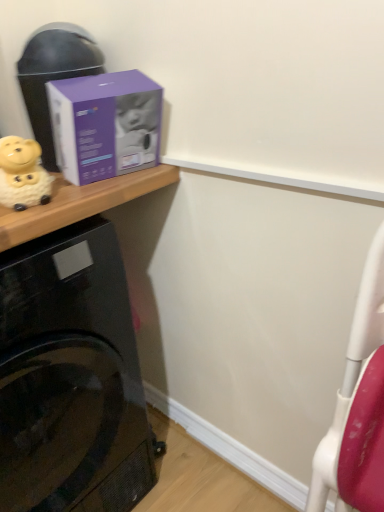
Question: Can you confirm if black glossy washing machine at lower left is smaller than yellow matte piggy bank at left?

Choices:
 (A) yes
 (B) no

Answer: (B)

Question: From a real-world perspective, is black glossy washing machine at lower left located beneath yellow matte piggy bank at left?

Choices:
 (A) yes
 (B) no

Answer: (A)

Question: Is black glossy washing machine at lower left next to yellow matte piggy bank at left and touching it?

Choices:
 (A) no
 (B) yes

Answer: (A)

Question: Would you say black glossy washing machine at lower left is a long distance from yellow matte piggy bank at left?

Choices:
 (A) yes
 (B) no

Answer: (B)

Question: Does black glossy washing machine at lower left appear on the right side of yellow matte piggy bank at left?

Choices:
 (A) no
 (B) yes

Answer: (A)

Question: Looking at the image, does black glossy washing machine at lower left seem bigger or smaller compared to purple cardboard box at upper left?

Choices:
 (A) big
 (B) small

Answer: (A)

Question: Is black glossy washing machine at lower left wider or thinner than purple cardboard box at upper left?

Choices:
 (A) wide
 (B) thin

Answer: (A)

Question: From their relative heights in the image, would you say black glossy washing machine at lower left is taller or shorter than purple cardboard box at upper left?

Choices:
 (A) tall
 (B) short

Answer: (A)

Question: From the image's perspective, is black glossy washing machine at lower left above or below purple cardboard box at upper left?

Choices:
 (A) below
 (B) above

Answer: (A)

Question: Would you say purple matte box at upper left is inside or outside black glossy washing machine at lower left?

Choices:
 (A) outside
 (B) inside

Answer: (A)

Question: From the image's perspective, relative to black glossy washing machine at lower left, is purple matte box at upper left above or below?

Choices:
 (A) above
 (B) below

Answer: (A)

Question: Visually, is purple matte box at upper left positioned to the left or to the right of black glossy washing machine at lower left?

Choices:
 (A) left
 (B) right

Answer: (B)

Question: From a real-world perspective, is purple matte box at upper left physically located above or below black glossy washing machine at lower left?

Choices:
 (A) below
 (B) above

Answer: (B)

Question: From a real-world perspective, is purple cardboard box at upper left above or below purple matte box at upper left?

Choices:
 (A) below
 (B) above

Answer: (B)

Question: Based on their sizes in the image, would you say purple cardboard box at upper left is bigger or smaller than purple matte box at upper left?

Choices:
 (A) small
 (B) big

Answer: (A)